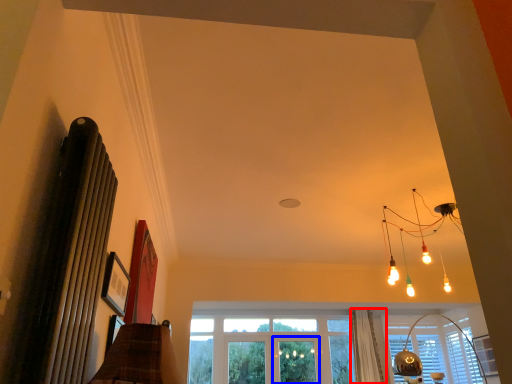
Question: Among these objects, which one is nearest to the camera, curtain (highlighted by a red box) or screen door (highlighted by a blue box)?

Choices:
 (A) curtain
 (B) screen door

Answer: (A)